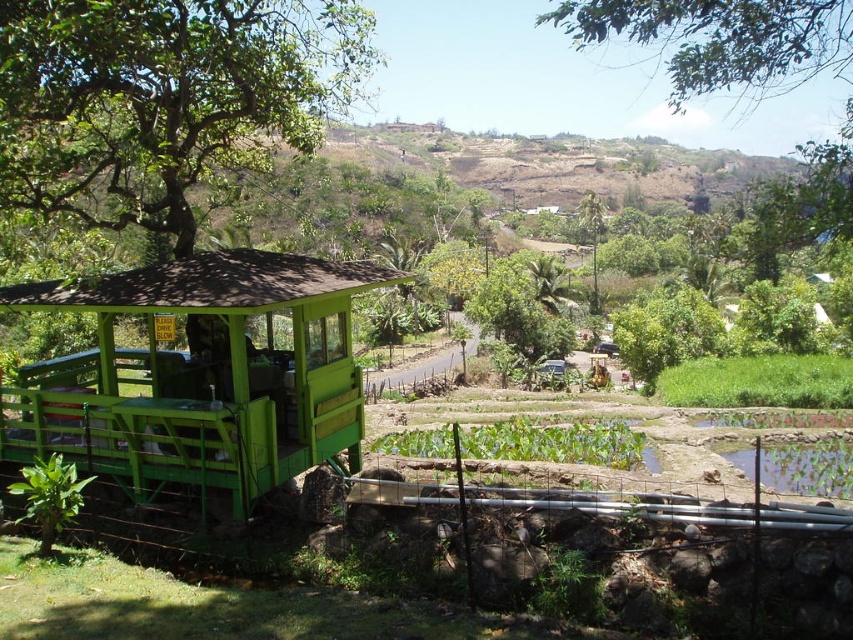
Question: Is green leafy tree at upper left above green leafy tree at upper center?

Choices:
 (A) no
 (B) yes

Answer: (A)

Question: Can you confirm if green leafy tree at upper left is positioned to the left of green matte gazebo at center?

Choices:
 (A) no
 (B) yes

Answer: (B)

Question: Among these points, which one is nearest to the camera?

Choices:
 (A) (268, 433)
 (B) (222, 17)

Answer: (A)

Question: Considering the real-world distances, which object is farthest from the green leafy tree at upper center?

Choices:
 (A) green leafy tree at upper left
 (B) green matte gazebo at center

Answer: (A)

Question: Among these points, which one is nearest to the camera?

Choices:
 (A) (717, 38)
 (B) (195, 106)

Answer: (A)

Question: Is the position of green matte gazebo at center more distant than that of green leafy tree at upper center?

Choices:
 (A) no
 (B) yes

Answer: (A)